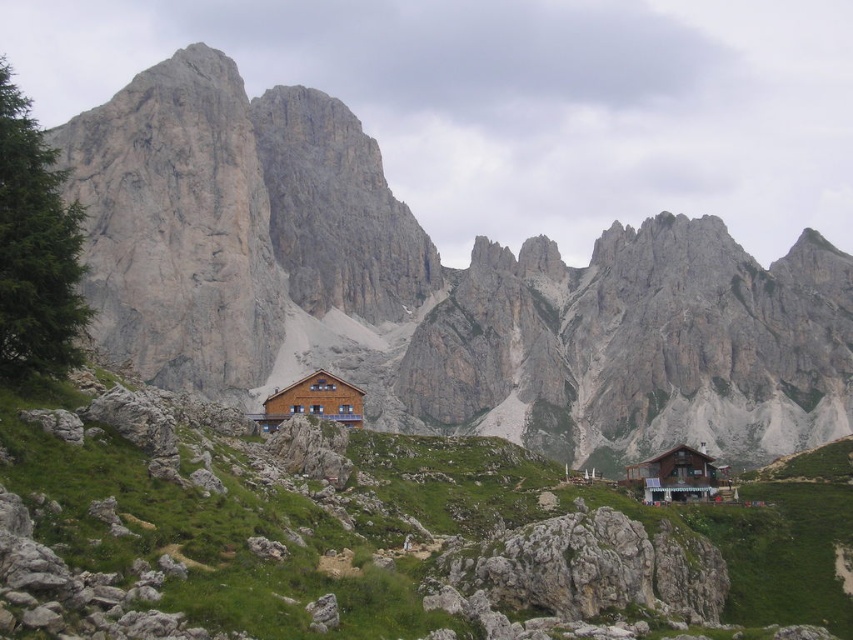
Question: Which of these objects is positioned farthest from the wooden cabin at lower right?

Choices:
 (A) matte brown wooden cabin at center
 (B) wooden cabin at center

Answer: (A)

Question: Can you confirm if wooden cabin at center is thinner than wooden cabin at lower right?

Choices:
 (A) no
 (B) yes

Answer: (B)

Question: Is the position of matte brown wooden cabin at center less distant than that of wooden cabin at lower right?

Choices:
 (A) no
 (B) yes

Answer: (A)

Question: Among these objects, which one is farthest from the camera?

Choices:
 (A) matte brown wooden cabin at center
 (B) wooden cabin at center

Answer: (A)

Question: Which point appears farthest from the camera in this image?

Choices:
 (A) (389, 193)
 (B) (318, 394)

Answer: (A)

Question: Is wooden cabin at center wider than wooden cabin at lower right?

Choices:
 (A) no
 (B) yes

Answer: (A)